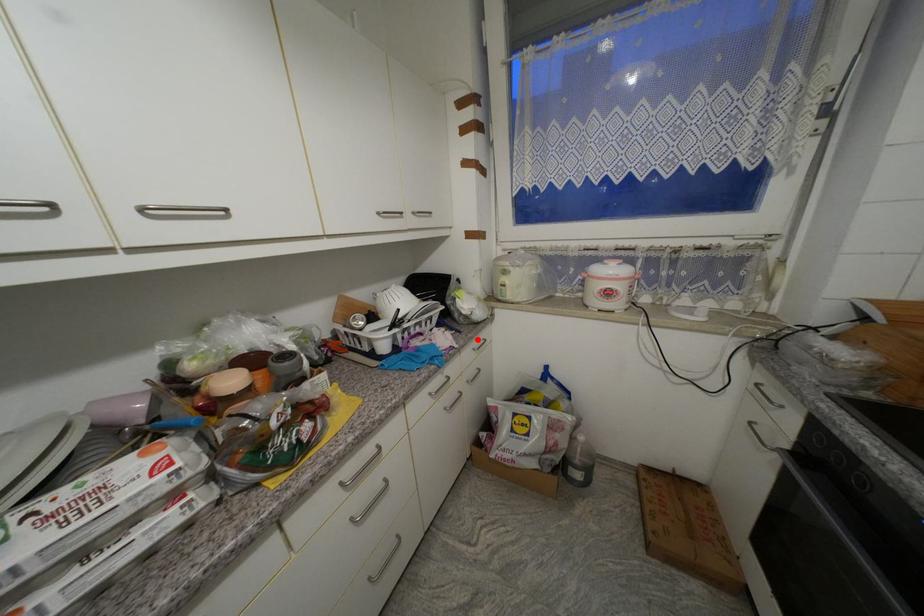
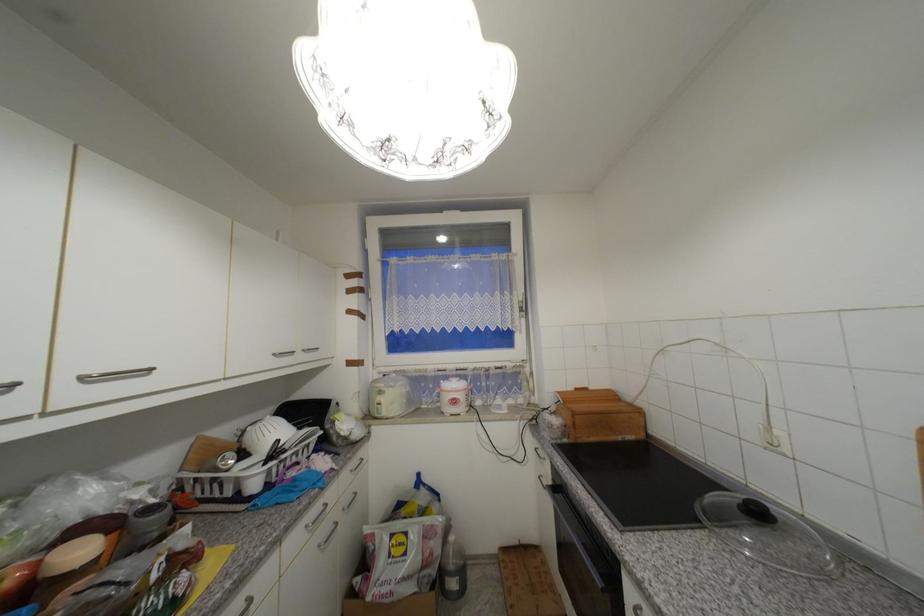
In the second image, find the point that corresponds to the highlighted location in the first image.

(357, 460)